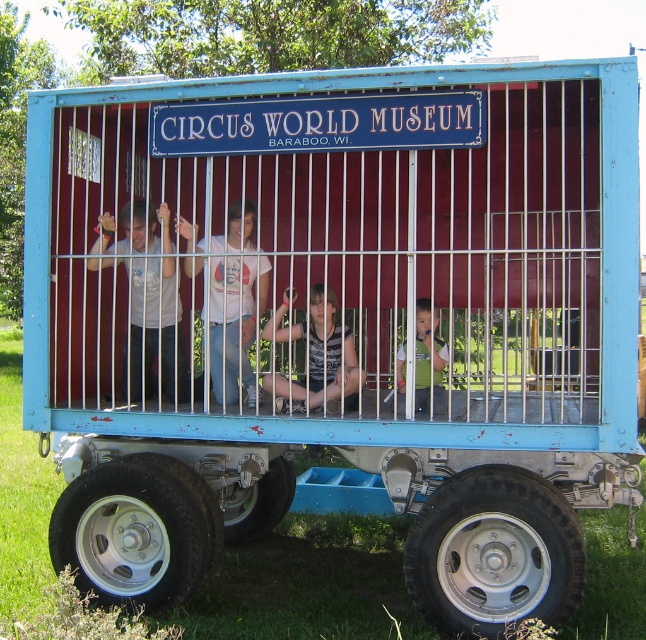
Question: From the image, what is the correct spatial relationship of matte white shirt at center in relation to white cotton t-shirt at center?

Choices:
 (A) above
 (B) below

Answer: (B)

Question: Which of the following is the farthest from the observer?

Choices:
 (A) matte white shirt at center
 (B) white cotton t-shirt at center
 (C) light brown wooden chair at center
 (D) light blue plastic child at center

Answer: (A)

Question: Can you confirm if light brown wooden chair at center is positioned below light blue plastic child at center?

Choices:
 (A) yes
 (B) no

Answer: (B)

Question: Which object is the closest to the matte white shirt at center?

Choices:
 (A) light blue plastic child at center
 (B) white cotton t-shirt at center
 (C) light brown wooden chair at center

Answer: (B)

Question: Which object appears farthest from the camera in this image?

Choices:
 (A) light brown wooden chair at center
 (B) light blue plastic child at center

Answer: (A)

Question: Can you confirm if white cotton t-shirt at center is bigger than light brown wooden chair at center?

Choices:
 (A) yes
 (B) no

Answer: (A)